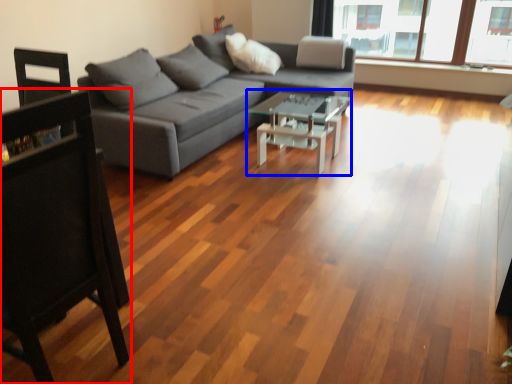
Question: Which object is further to the camera taking this photo, chair (highlighted by a red box) or coffee table (highlighted by a blue box)?

Choices:
 (A) chair
 (B) coffee table

Answer: (B)